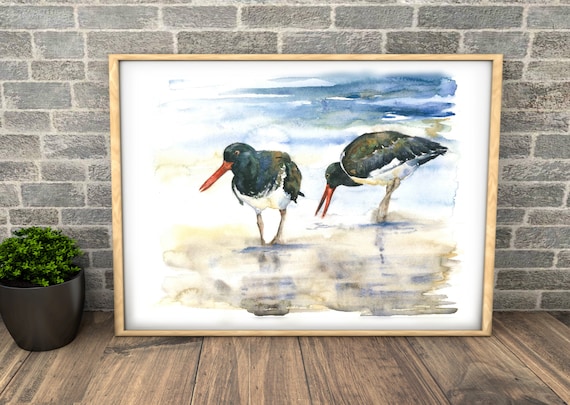
Identify the location of bird painting. This screenshot has width=570, height=405. (287, 184), (385, 174).